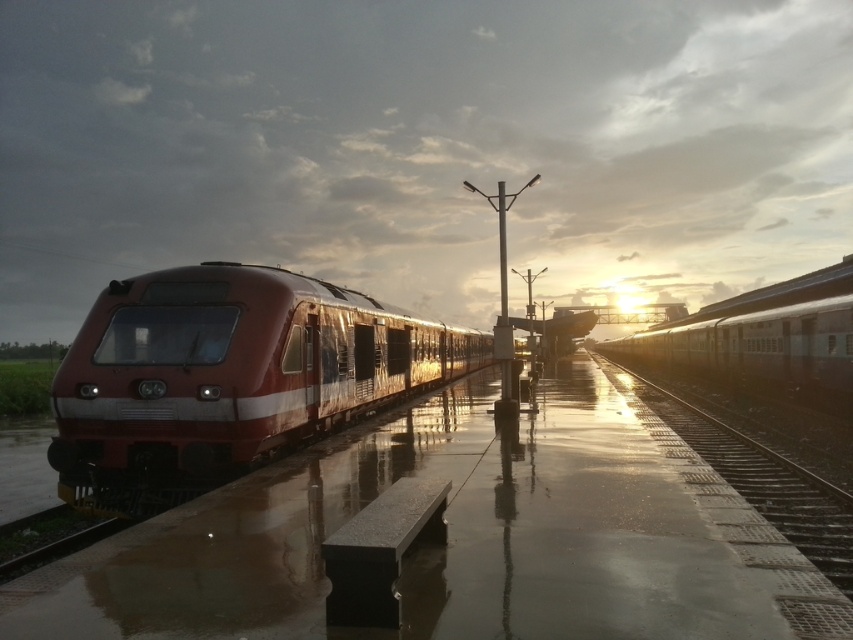
Question: Which object is farther from the camera taking this photo?

Choices:
 (A) silver metallic train at upper right
 (B) metallic red train at left
 (C) shiny red train at left

Answer: (A)

Question: Does metallic red train at left appear on the right side of metallic train track at right?

Choices:
 (A) yes
 (B) no

Answer: (B)

Question: Observing the image, what is the correct spatial positioning of metallic red train at left in reference to silver metallic train at upper right?

Choices:
 (A) below
 (B) above

Answer: (A)

Question: Among these objects, which one is farthest from the camera?

Choices:
 (A) silver metallic train at upper right
 (B) shiny red train at left
 (C) metallic train track at right
 (D) metallic red train at left

Answer: (A)

Question: Which of the following is the farthest from the observer?

Choices:
 (A) silver metallic train at upper right
 (B) metallic red train at left

Answer: (A)

Question: Does silver metallic train at upper right appear on the left side of metallic train track at right?

Choices:
 (A) yes
 (B) no

Answer: (B)